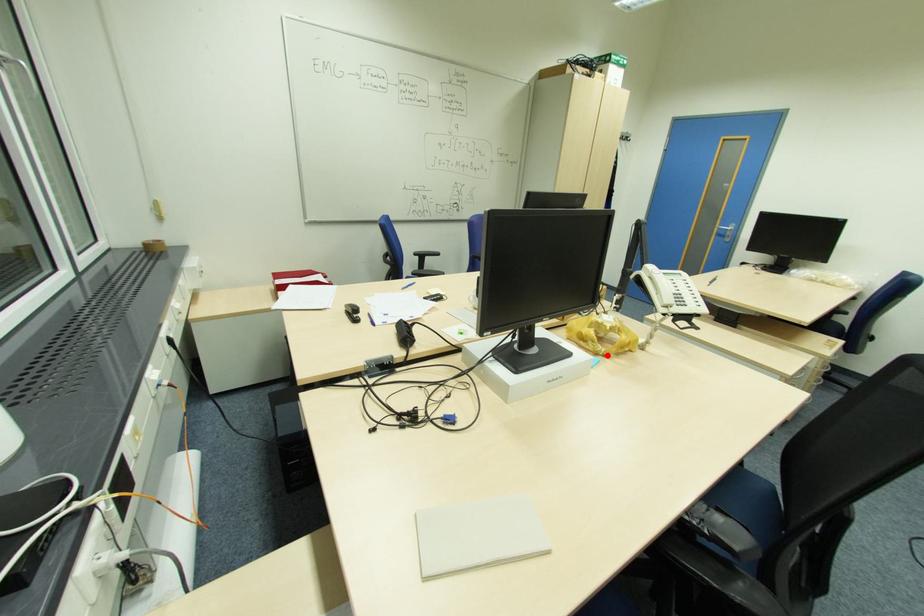
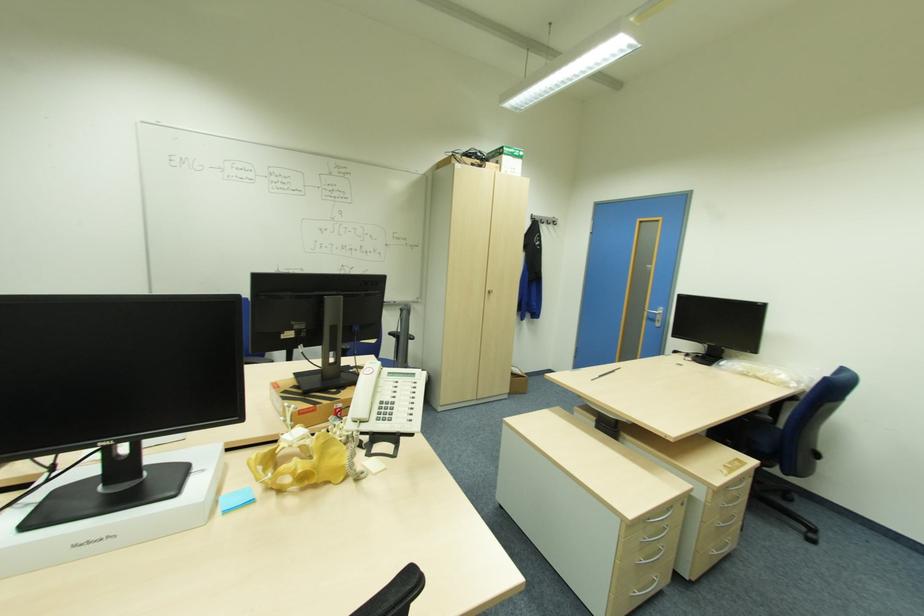
Where in the second image is the point corresponding to the highlighted location from the first image?

(283, 490)